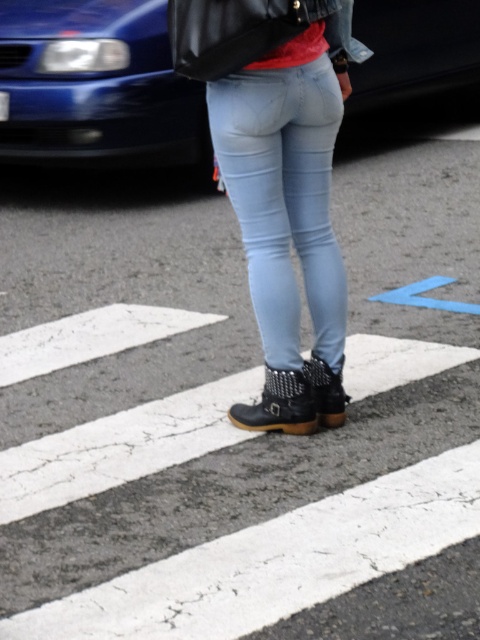
Question: Which of the following is the farthest from the observer?

Choices:
 (A) blue metallic car at upper left
 (B) black textured boot at lower center
 (C) light blue denim jeans at center
 (D) leather boots at center

Answer: (A)

Question: Which of these objects is positioned closest to the leather boots at center?

Choices:
 (A) blue metallic car at upper left
 (B) black textured boot at lower center
 (C) light blue denim jeans at center

Answer: (B)

Question: Does light blue denim jeans at center have a larger size compared to black textured boot at lower center?

Choices:
 (A) yes
 (B) no

Answer: (A)

Question: Is light blue denim jeans at center positioned in front of leather boots at center?

Choices:
 (A) no
 (B) yes

Answer: (B)

Question: Can you confirm if light blue denim jeans at center is positioned to the left of leather boots at center?

Choices:
 (A) no
 (B) yes

Answer: (A)

Question: Among these points, which one is farthest from the camera?

Choices:
 (A) (141, 115)
 (B) (277, 420)
 (C) (312, 268)

Answer: (A)